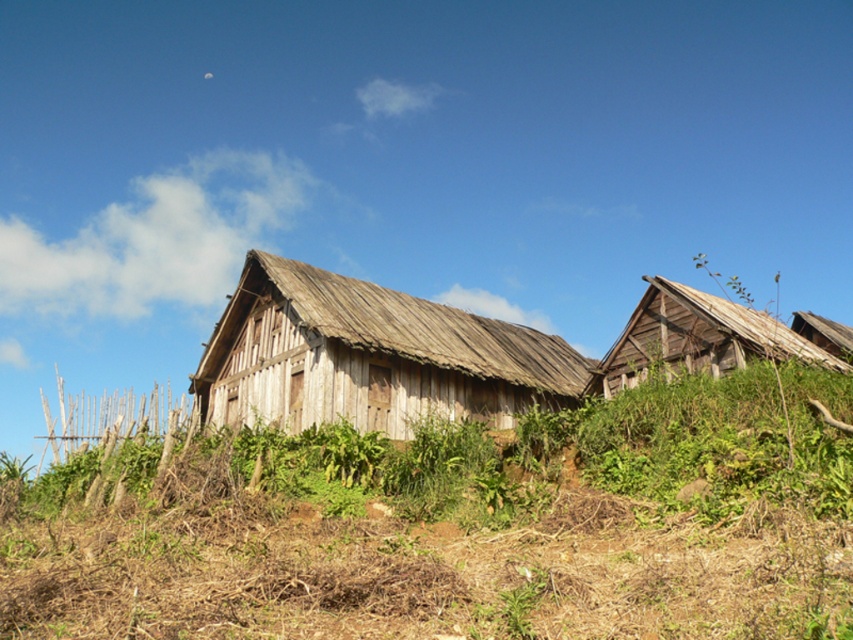
Question: Which of the following is the closest to the observer?

Choices:
 (A) weathered wood hut at center
 (B) weathered wood hut at right
 (C) weathered wood hut at upper right

Answer: (B)

Question: Based on their relative distances, which object is nearer to the weathered wood hut at center?

Choices:
 (A) weathered wood hut at upper right
 (B) weathered wood hut at right

Answer: (B)

Question: Among these objects, which one is farthest from the camera?

Choices:
 (A) weathered wood hut at right
 (B) weathered wood hut at center
 (C) weathered wood hut at upper right

Answer: (C)

Question: Is the position of weathered wood hut at right less distant than that of weathered wood hut at upper right?

Choices:
 (A) yes
 (B) no

Answer: (A)

Question: Is weathered wood hut at right wider than weathered wood hut at upper right?

Choices:
 (A) no
 (B) yes

Answer: (B)

Question: Is weathered wood hut at right smaller than weathered wood hut at upper right?

Choices:
 (A) no
 (B) yes

Answer: (A)